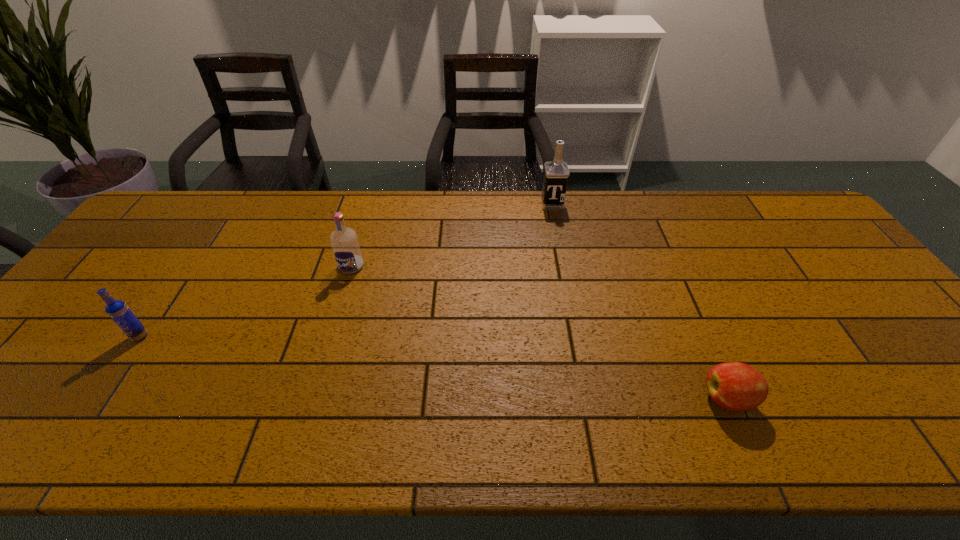
Image resolution: width=960 pixels, height=540 pixels. Identify the location of the second object from right to left. (556, 172).

The height and width of the screenshot is (540, 960). I want to click on the rightmost vodka, so click(556, 172).

I want to click on the second farthest vodka, so click(344, 241).

This screenshot has width=960, height=540. Find the location of `the third object from right to left`. the third object from right to left is located at coordinates (344, 241).

Locate an element on the screen. This screenshot has width=960, height=540. the leftmost object is located at coordinates (119, 312).

Where is `the second nearest object`? This screenshot has height=540, width=960. the second nearest object is located at coordinates (119, 312).

The image size is (960, 540). What are the coordinates of `the nearest object` in the screenshot? It's located at (735, 386).

I want to click on the rightmost object, so click(x=735, y=386).

The height and width of the screenshot is (540, 960). In order to click on blank space located 0.380m on the front label of the farthest vodka in this screenshot , I will do coord(569,294).

Identify the location of free region located on the label of the third object from right to left. (x=344, y=291).